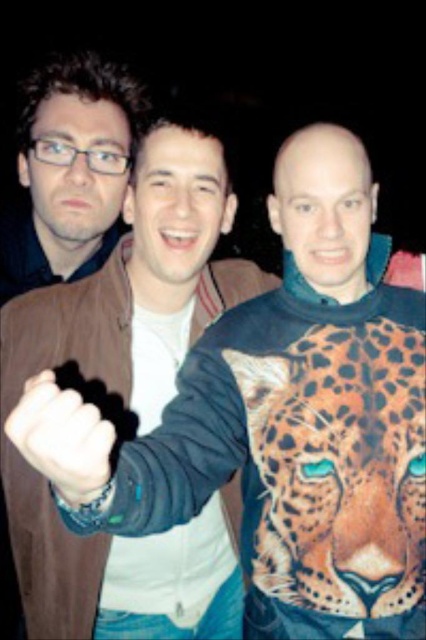
You are taking a photo of the three people in the image. The camera you are using has a focus point at position 0.717, 0.784. Which person should you focus on to capture the orange printed leopard at center clearly?

The orange printed leopard at center is located at point (333, 458), so you should focus on the third person on the right wearing a dark jacket over a patterned shirt with the orange printed leopard at center to capture it clearly.

You are a photographer adjusting the lighting for a nighttime photo shoot. You notice the orange printed leopard at center and the black leather glove at center in the frame. Which object should you focus on first if you want to ensure both are properly lit, considering their positions?

The orange printed leopard at center is located below the black leather glove at center. Since the leopard is lower, you should focus on the black leather glove at center first to adjust the lighting from top to bottom effectively.

You are taking a photo of three friends at night. You notice a point at coordinate (333, 458). What is the object at that point?

The point at coordinate (333, 458) indicates an orange printed leopard at center.